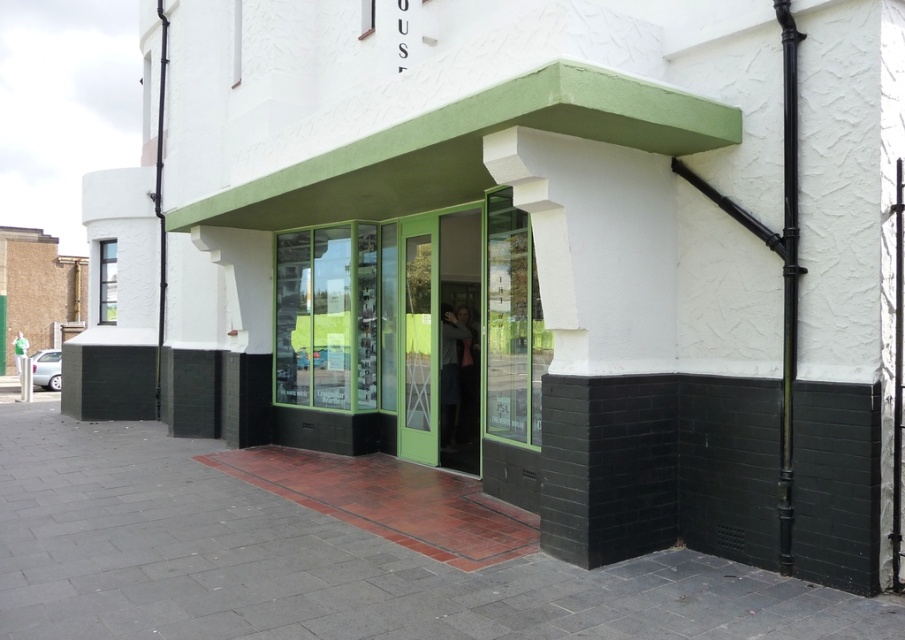
Image resolution: width=905 pixels, height=640 pixels. Describe the element at coordinates (330, 561) in the screenshot. I see `smooth brick pavement at center` at that location.

Does smooth brick pavement at center appear over white smooth pillar at center?

Incorrect, smooth brick pavement at center is not positioned above white smooth pillar at center.

Does point (183, 545) lie in front of point (575, 486)?

No, (183, 545) is further to viewer.

Where is `smooth brick pavement at center`? Image resolution: width=905 pixels, height=640 pixels. smooth brick pavement at center is located at coordinates (330, 561).

From the picture: Does smooth brick pavement at center have a lesser width compared to green glass door at center?

No, smooth brick pavement at center is not thinner than green glass door at center.

Is point (62, 524) more distant than point (278, 358)?

No, it is not.

The width and height of the screenshot is (905, 640). I want to click on smooth brick pavement at center, so click(x=330, y=561).

Does green glass door at center have a smaller size compared to white smooth pillar at center?

Incorrect, green glass door at center is not smaller in size than white smooth pillar at center.

What do you see at coordinates (417, 340) in the screenshot?
I see `green glass door at center` at bounding box center [417, 340].

Describe the element at coordinates (417, 340) in the screenshot. This screenshot has height=640, width=905. I see `green glass door at center` at that location.

At what (x,y) coordinates should I click in order to perform the action: click on green glass door at center. Please return your answer as a coordinate pair (x, y). This screenshot has height=640, width=905. Looking at the image, I should click on (417, 340).